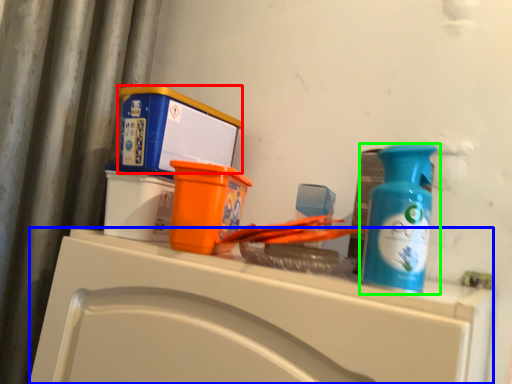
Question: Which object is positioned farthest from box (highlighted by a red box)? Select from counter (highlighted by a blue box) and bottle (highlighted by a green box).

Choices:
 (A) counter
 (B) bottle

Answer: (B)